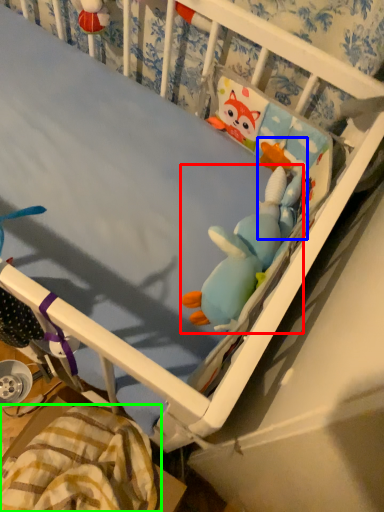
Question: Which object is positioned farthest from toy (highlighted by a red box)? Select from toy (highlighted by a blue box) and blanket (highlighted by a green box).

Choices:
 (A) toy
 (B) blanket

Answer: (B)